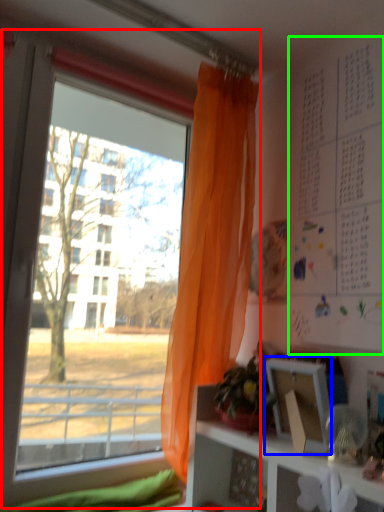
Question: Considering the real-world distances, which object is closest to window (highlighted by a red box)? picture frame (highlighted by a blue box) or bulletin board (highlighted by a green box).

Choices:
 (A) picture frame
 (B) bulletin board

Answer: (B)